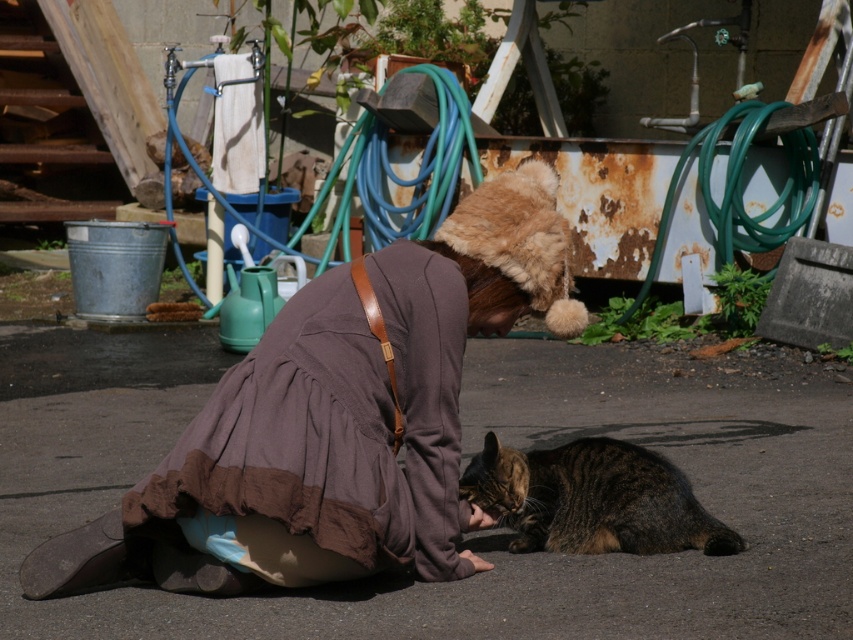
You are a photographer setting up a shoot in this scene. You want to position a light source behind the blue rubber hose at upper center to highlight it. However, there is a brown cotton robe at center in the way. Can you place the light behind the hose without moving the robe?

The brown cotton robe at center is in front of the blue rubber hose at upper center, so the robe is blocking the path behind the hose. You cannot place the light behind the hose without moving the robe.

You are standing at the point labeled as point (788, 228) and want to move to the point labeled as point (671, 486). Which direction should you move to get closer to your destination?

You should move towards the direction of the camera because point (671, 486) is closer to the camera than point (788, 228).

You are standing at the point labeled point (361, 188) and want to move to the point labeled point (465, 305). Which direction should you move to get closer to the camera?

You should move towards point (465, 305) because it is closer to the camera than point (361, 188).